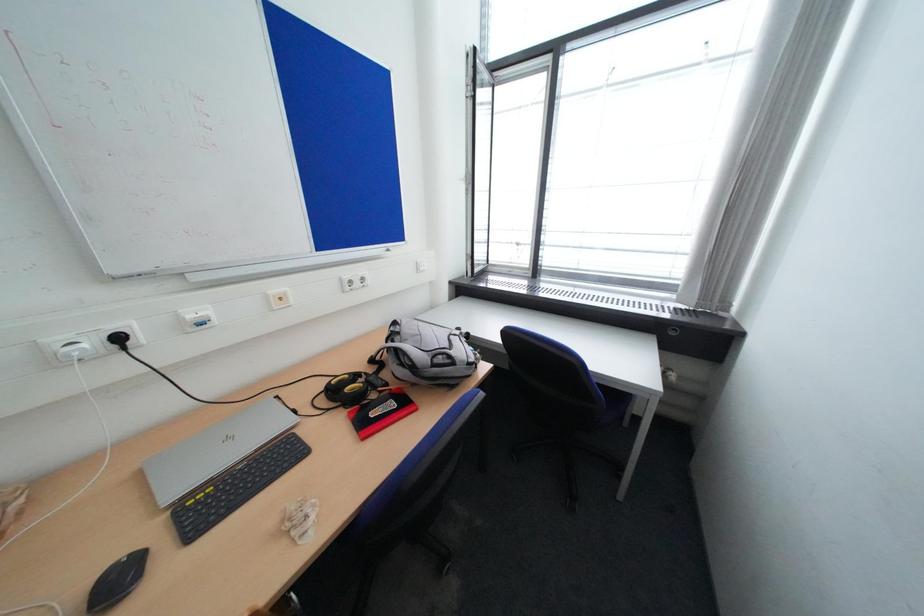
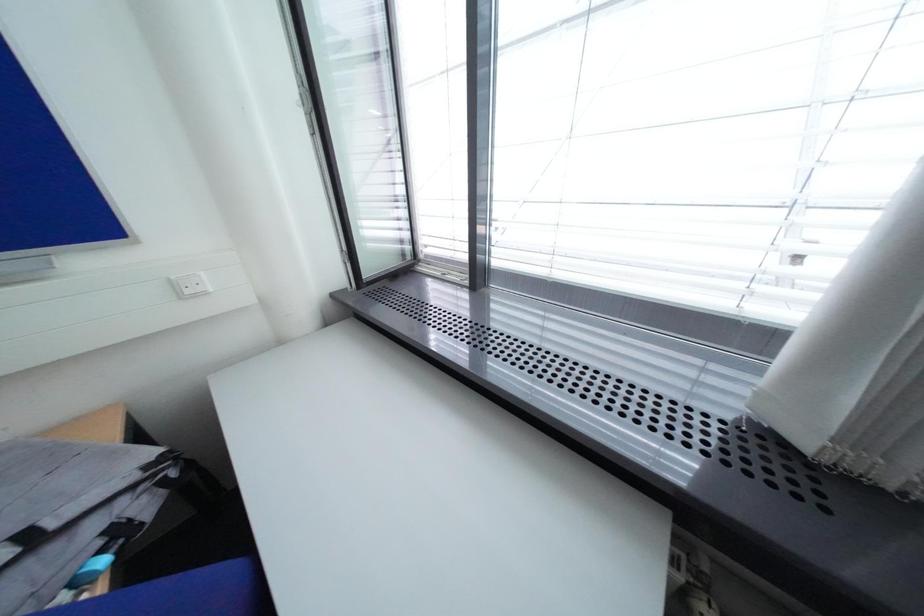
In a continuous first-person perspective shot, in which direction is the camera moving?

The movement direction of the cameraman is right, forward.